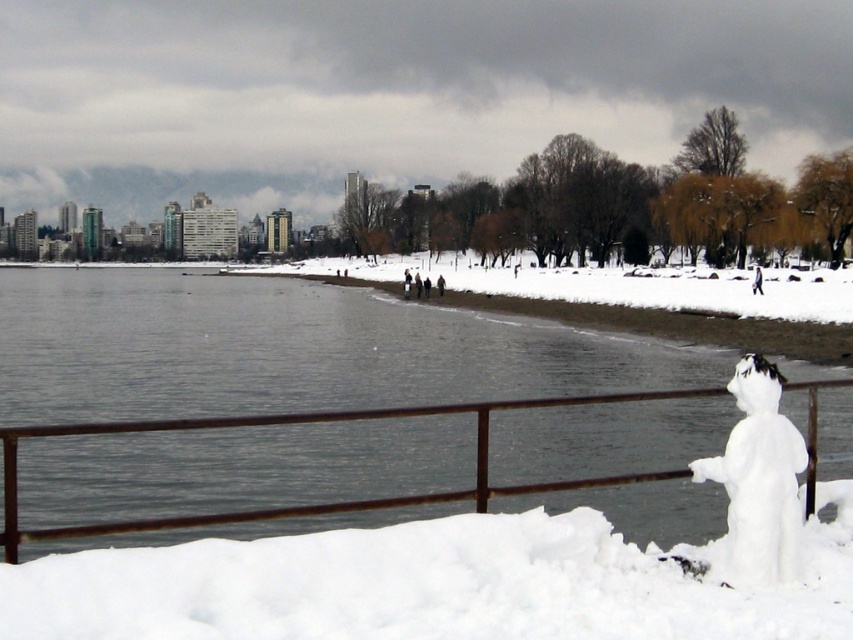
You are standing at the waterfront and want to take a photo of the rusty metal fence at lower center. If your camera can focus on objects up to 10 meters away, will you need to move closer to take a clear photo?

The distance between the rusty metal fence at lower center and the camera is 6.49 meters, which is within the camera focus range of up to 10 meters. Therefore, you do not need to move closer to take a clear photo.

You are a photographer planning to take a picture of the waterfront scene. You want to ensure that both the rusty metal fence at lower center and the white fluffy snowman at lower right are clearly visible in the frame. Based on their positions, which object should appear lower in the photo?

The rusty metal fence at lower center appears lower in the photo because it is positioned below the white fluffy snowman at lower right.

In the scene shown: You are a delivery robot with a width of 0.8 meters. You need to navigate between the rusty metal fence at lower center and the white fluffy snowman at lower right to reach the delivery point. Can you fit through the space between them?

The rusty metal fence at lower center might be wider than the white fluffy snowman at lower right, but since the exact width isn not provided, it is uncertain if the 0.8 meter wide robot can pass through safely. Check the actual distance before proceeding.